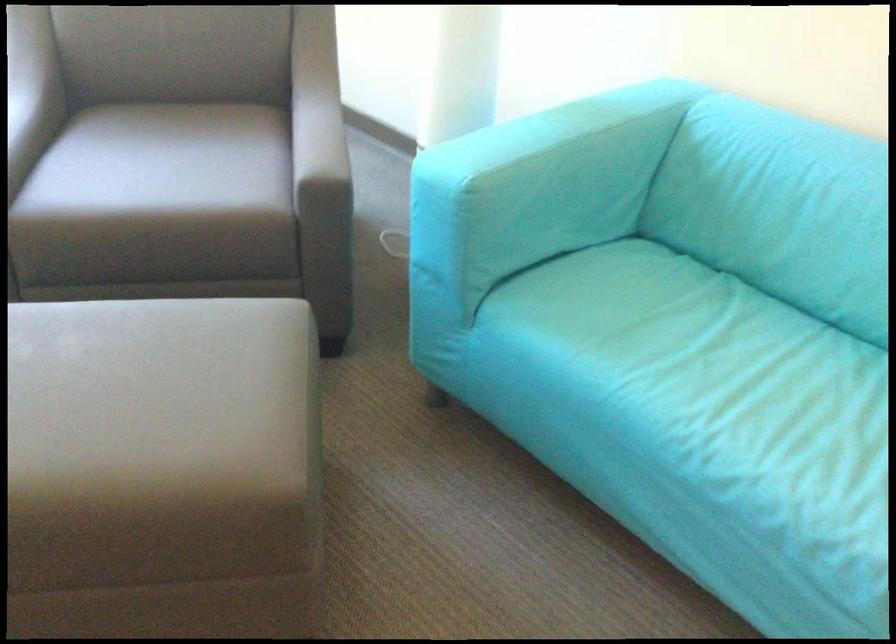
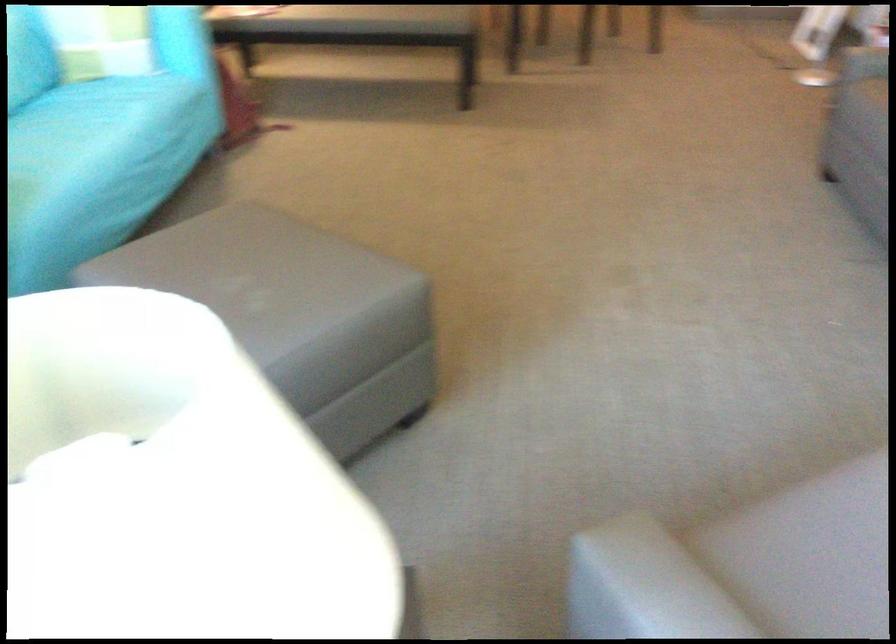
In the second image, find the point that corresponds to pixel 784 436 in the first image.

(87, 134)